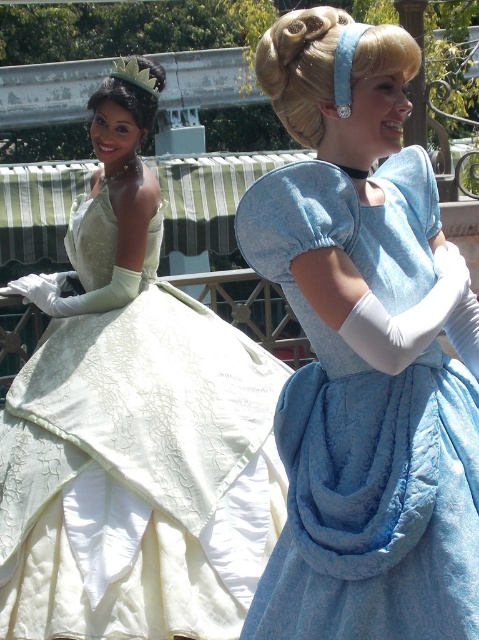
You are a photographer standing between the two princesses. You want to take a photo of both of them in the same frame. Given that your camera has a maximum focus range of 15 meters, will you be able to capture both the matte blue dress at center and the other princess in the frame?

The two princesses are 14.66 meters apart. Since the camera can focus up to 15 meters, you can capture both the matte blue dress at center and the other princess in the same frame as the distance between them is within the camera range.

You are a costume designer preparing for a play. You have two costumes in front of you, the matte blue dress at center and the matte green gown at center. The director wants to know which costume requires more fabric. Which one should you inform them about?

The matte blue dress at center is larger in size than the matte green gown at center, so it requires more fabric.